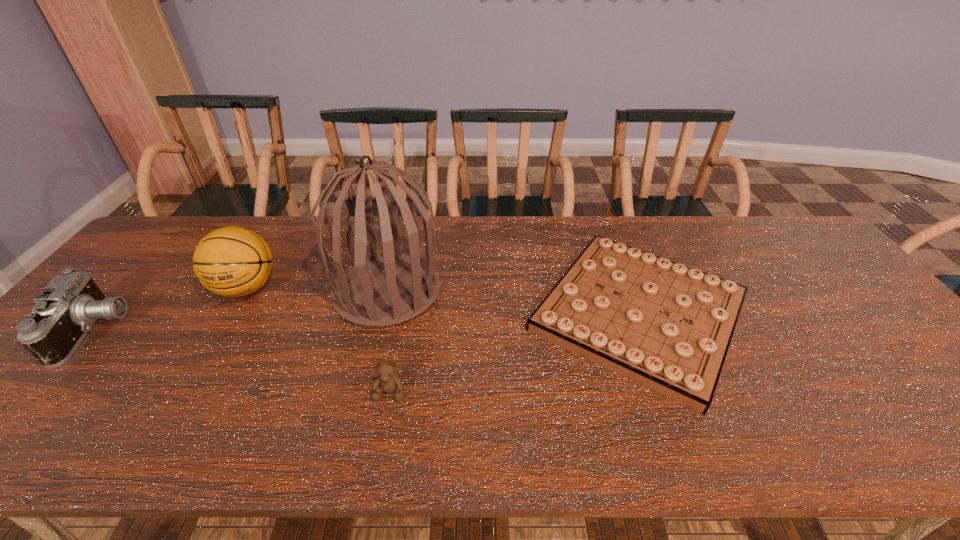
Identify which object is the closest to the tallest object. Please provide its 2D coordinates. Your answer should be formatted as a tuple, i.e. [(x, y)], where the tuple contains the x and y coordinates of a point satisfying the conditions above.

[(387, 381)]

The width and height of the screenshot is (960, 540). Identify the location of free spot that satisfies the following two spatial constraints: 1. on the surface of the basketball near the brand logo; 2. at the lens of the leftmost object. (221, 332).

Identify the location of vacant position in the image that satisfies the following two spatial constraints: 1. on the surface of the gameboard near the brand logo; 2. on the right side of the fourth shortest object. (230, 314).

Where is `free point that satisfies the following two spatial constraints: 1. on the surface of the tallest object near the brand logo; 2. on the right side of the fourth shortest object`? This screenshot has width=960, height=540. free point that satisfies the following two spatial constraints: 1. on the surface of the tallest object near the brand logo; 2. on the right side of the fourth shortest object is located at coordinates (245, 291).